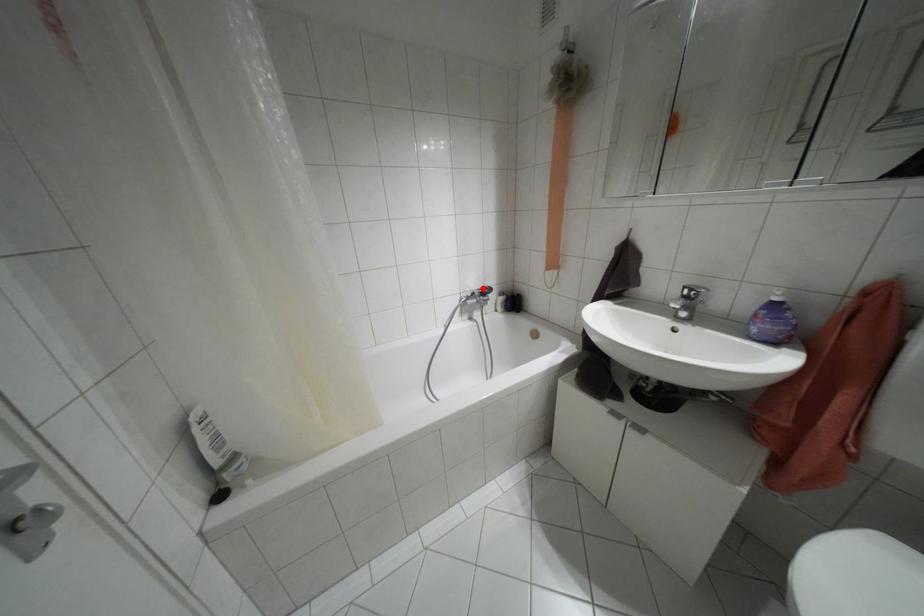
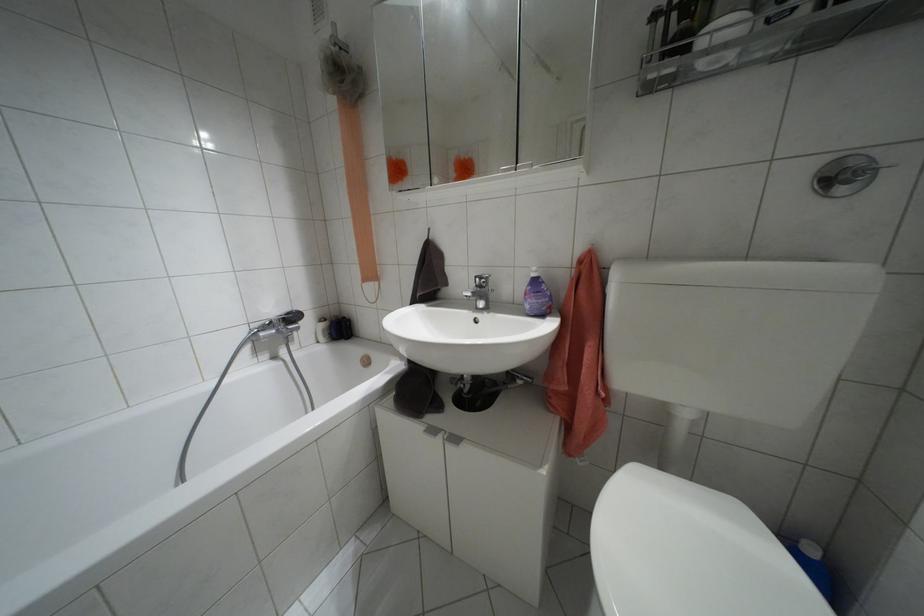
Locate, in the second image, the point that corresponds to the highlighted location in the first image.

(286, 313)